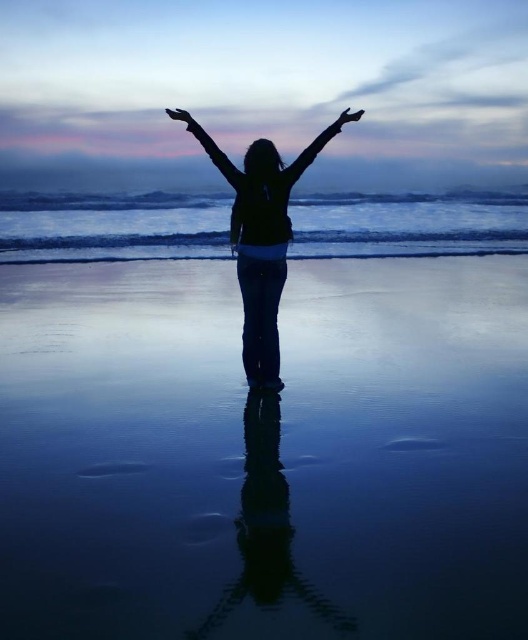
Is point (93, 592) positioned behind point (280, 257)?

That is False.

Who is more forward, (15, 352) or (266, 243)?

Positioned in front is point (266, 243).

Find the location of `smooth sand at center`. smooth sand at center is located at coordinates (265, 452).

Is black matte arm at center bigger than smooth black hand at upper center?

Indeed, black matte arm at center has a larger size compared to smooth black hand at upper center.

Can you confirm if black matte arm at center is positioned to the left of smooth black hand at upper center?

In fact, black matte arm at center is to the right of smooth black hand at upper center.

Does point (307, 145) come in front of point (187, 115)?

No, it is behind (187, 115).

Find the location of `black matte arm at center`. black matte arm at center is located at coordinates (315, 147).

Based on the photo, who is taller, silhouette fabric at center or black matte hand at upper right?

silhouette fabric at center

This screenshot has width=528, height=640. In order to click on silhouette fabric at center in this screenshot , I will do `click(261, 241)`.